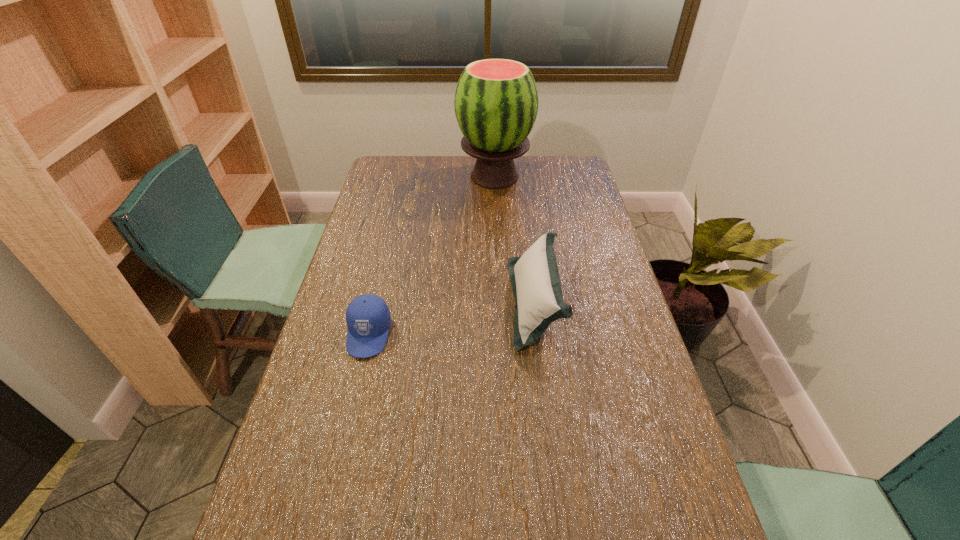
The width and height of the screenshot is (960, 540). In order to click on the farthest object in this screenshot , I will do `click(496, 101)`.

Image resolution: width=960 pixels, height=540 pixels. I want to click on watermelon, so click(x=496, y=101).

Locate an element on the screen. the second tallest object is located at coordinates (534, 276).

This screenshot has height=540, width=960. I want to click on cap, so click(368, 319).

The width and height of the screenshot is (960, 540). In order to click on the leftmost object in this screenshot , I will do `click(368, 319)`.

The height and width of the screenshot is (540, 960). Find the location of `free space located on the left of the watermelon`. free space located on the left of the watermelon is located at coordinates (405, 177).

I want to click on blank space located 0.230m on the surface of the second tallest object, so click(433, 302).

In order to click on free region located on the surface of the second tallest object in this screenshot , I will do `click(430, 302)`.

Locate an element on the screen. vacant point located on the surface of the second tallest object is located at coordinates [379, 302].

The width and height of the screenshot is (960, 540). Find the location of `free space located 0.270m on the front-facing side of the cap`. free space located 0.270m on the front-facing side of the cap is located at coordinates (339, 461).